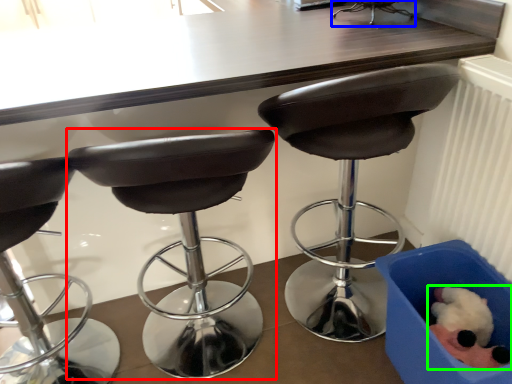
Question: Which object is the closest to the chair (highlighted by a red box)? Choose among these: chair (highlighted by a blue box) or animal (highlighted by a green box).

Choices:
 (A) chair
 (B) animal

Answer: (B)